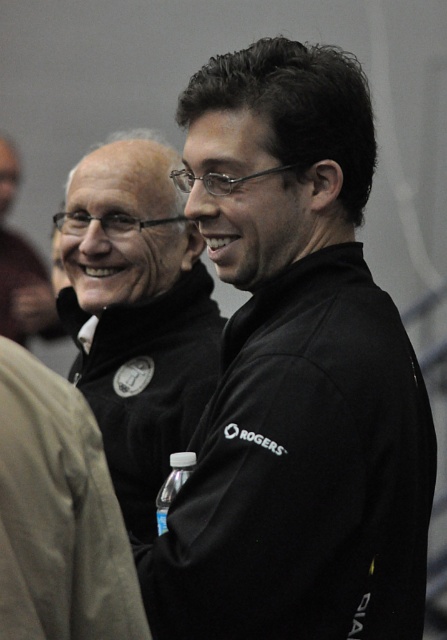
Does black matte jacket at upper center have a smaller size compared to black fleece sweatshirt at center?

No.

Is black matte jacket at upper center thinner than black fleece sweatshirt at center?

Incorrect, black matte jacket at upper center's width is not less than black fleece sweatshirt at center's.

Which is in front, point (190, 317) or point (24, 493)?

Positioned in front is point (24, 493).

This screenshot has width=447, height=640. I want to click on black matte jacket at upper center, so click(x=136, y=314).

Which of these two, black matte jacket at upper center or matte black jacket at upper left, stands shorter?

black matte jacket at upper center

Does black matte jacket at upper center have a greater height compared to matte black jacket at upper left?

No, black matte jacket at upper center is not taller than matte black jacket at upper left.

What are the coordinates of `black matte jacket at upper center` in the screenshot? It's located at (136, 314).

Does black matte jacket at center have a lesser height compared to matte black jacket at upper left?

Incorrect, black matte jacket at center's height does not fall short of matte black jacket at upper left's.

Between black matte jacket at center and matte black jacket at upper left, which one is positioned higher?

matte black jacket at upper left

Which is behind, point (367, 474) or point (21, 260)?

Point (21, 260)

This screenshot has height=640, width=447. I want to click on black matte jacket at center, so click(x=295, y=372).